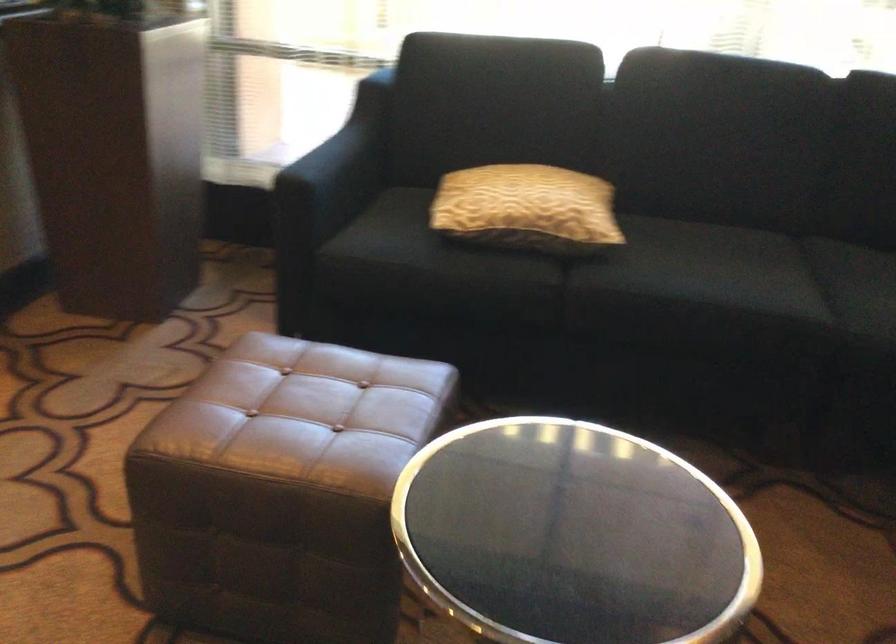
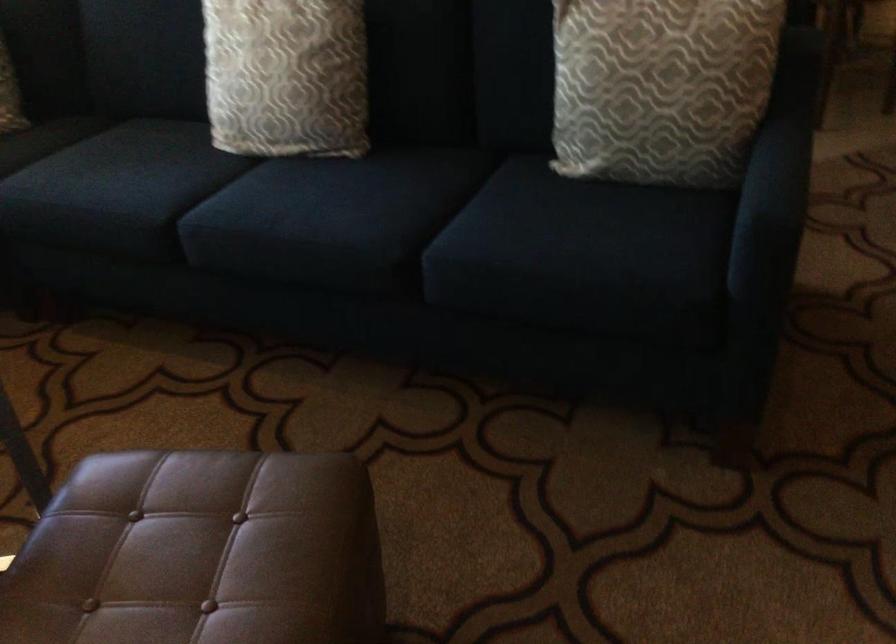
How did the camera likely rotate?

The camera rotated toward right-down.